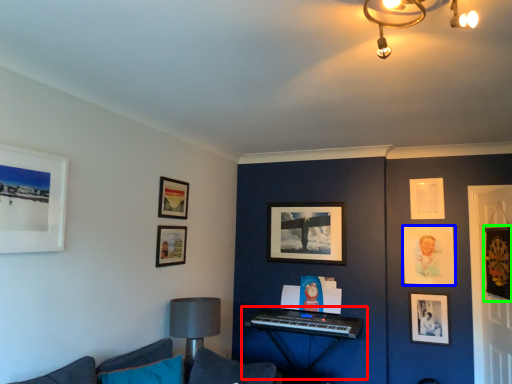
Question: Which object is the closest to the piano (highlighted by a red box)? Choose among these: picture frame (highlighted by a blue box) or picture frame (highlighted by a green box).

Choices:
 (A) picture frame
 (B) picture frame

Answer: (A)